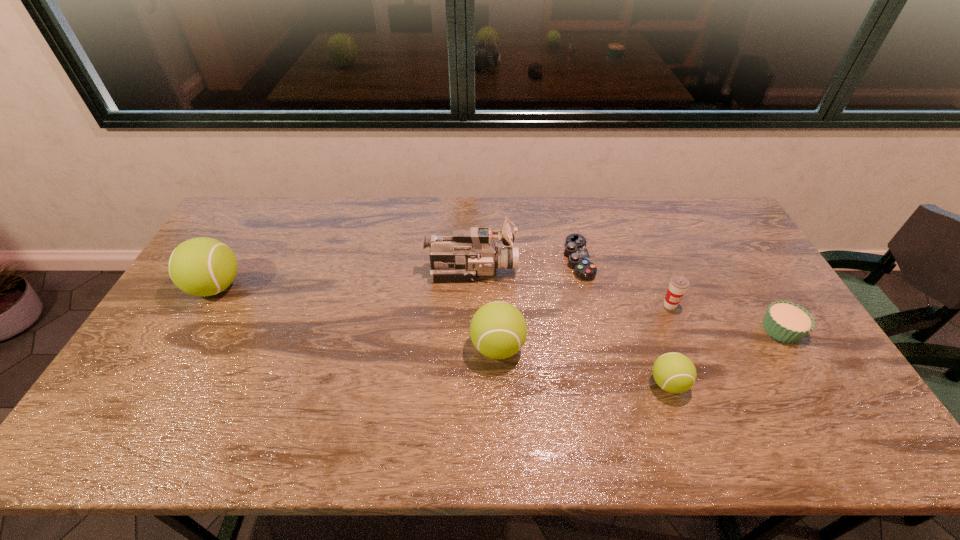
Where is `object that is at the right edge`? Image resolution: width=960 pixels, height=540 pixels. object that is at the right edge is located at coordinates (785, 321).

You are a GUI agent. You are given a task and a screenshot of the screen. Output one action in this format:
    pyautogui.click(x=<x>, y=<y>)
    Task: Click on the vacant space at the far edge
    This screenshot has height=540, width=960.
    Given the screenshot: What is the action you would take?
    pyautogui.click(x=609, y=231)

This screenshot has height=540, width=960. What are the coordinates of `vacant position at the near edge of the desktop` in the screenshot? It's located at (398, 396).

The width and height of the screenshot is (960, 540). I want to click on free region at the left edge of the desktop, so click(x=194, y=321).

Find the location of a particular element. Image resolution: width=960 pixels, height=540 pixels. vacant space at the right edge of the desktop is located at coordinates (756, 350).

Where is `free space at the far left corner`? This screenshot has height=540, width=960. free space at the far left corner is located at coordinates (278, 205).

You are a GUI agent. You are given a task and a screenshot of the screen. Output one action in this format:
    pyautogui.click(x=<x>, y=<y>)
    Task: Click on the vacant region at the near left corner of the desktop
    
    Given the screenshot: What is the action you would take?
    pyautogui.click(x=130, y=396)

The width and height of the screenshot is (960, 540). In order to click on free space between the leftmost object and the third shortest object in this screenshot , I will do `click(443, 335)`.

At what (x,y) coordinates should I click in order to perform the action: click on free space that is in between the second object from right to left and the rightmost tennis ball. Please return your answer as a coordinate pair (x, y). The image size is (960, 540). Looking at the image, I should click on (669, 345).

At what (x,y) coordinates should I click in order to perform the action: click on vacant space in between the shortest object and the cup. Please return your answer as a coordinate pair (x, y). This screenshot has width=960, height=540. Looking at the image, I should click on (624, 282).